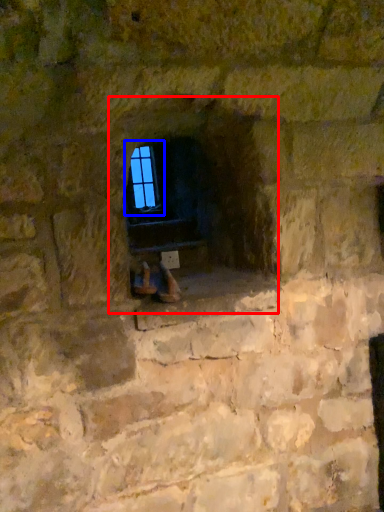
Question: Among these objects, which one is nearest to the camera, fireplace (highlighted by a red box) or window (highlighted by a blue box)?

Choices:
 (A) fireplace
 (B) window

Answer: (A)